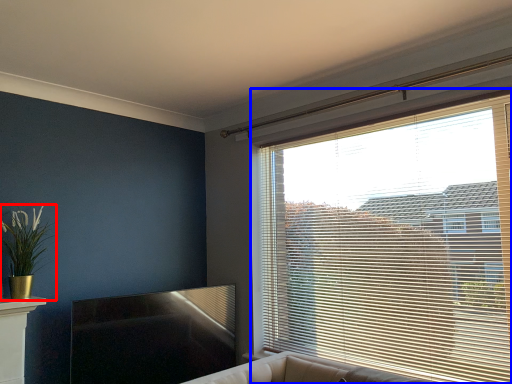
Question: Among these objects, which one is nearest to the camera, houseplant (highlighted by a red box) or window blind (highlighted by a blue box)?

Choices:
 (A) houseplant
 (B) window blind

Answer: (B)